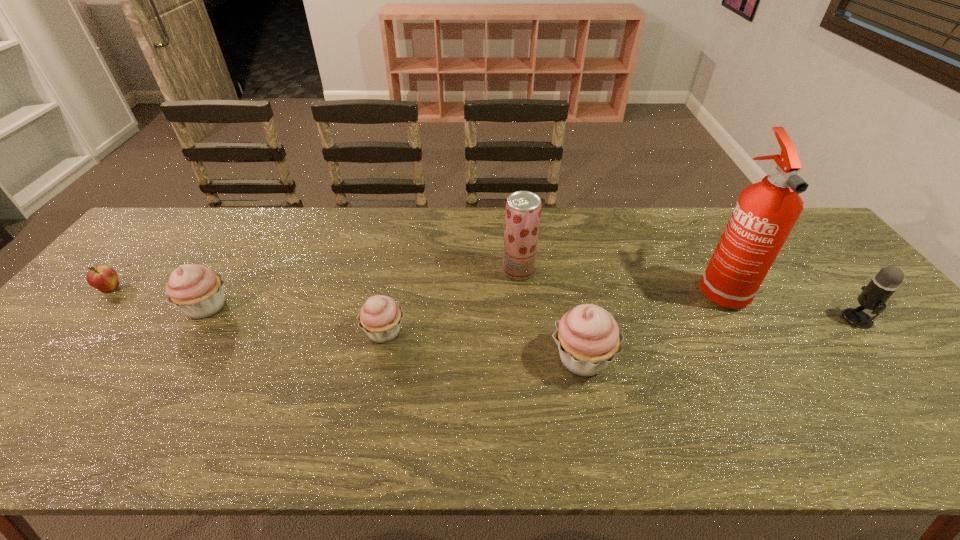
I want to click on object present at the left edge, so click(104, 278).

Where is `object that is positioned at the right edge`? object that is positioned at the right edge is located at coordinates (873, 297).

In the image, there is a desktop. Identify the location of free space at the far edge. (457, 215).

Find the location of a particular element. This screenshot has width=960, height=540. free location at the near edge is located at coordinates (829, 399).

You are a GUI agent. You are given a task and a screenshot of the screen. Output one action in this format:
    pyautogui.click(x=<x>, y=<y>)
    Task: Click on the vacant space that's between the sixth shortest object and the shortest object
    The width and height of the screenshot is (960, 540).
    Given the screenshot: What is the action you would take?
    pyautogui.click(x=315, y=280)

Locate an element on the screen. vacant space in between the fire extinguisher and the leftmost cupcake is located at coordinates (463, 297).

The width and height of the screenshot is (960, 540). Identify the location of vacant space that's between the second cupcake from right to left and the fire extinguisher. (551, 309).

Where is `free space between the third shortest object and the apple`? This screenshot has height=540, width=960. free space between the third shortest object and the apple is located at coordinates (158, 298).

Locate an element on the screen. free space that is in between the shortest object and the sixth object from left to right is located at coordinates (415, 288).

The height and width of the screenshot is (540, 960). In order to click on vacant space in between the rightmost object and the sixth object from left to right in this screenshot , I will do `click(788, 303)`.